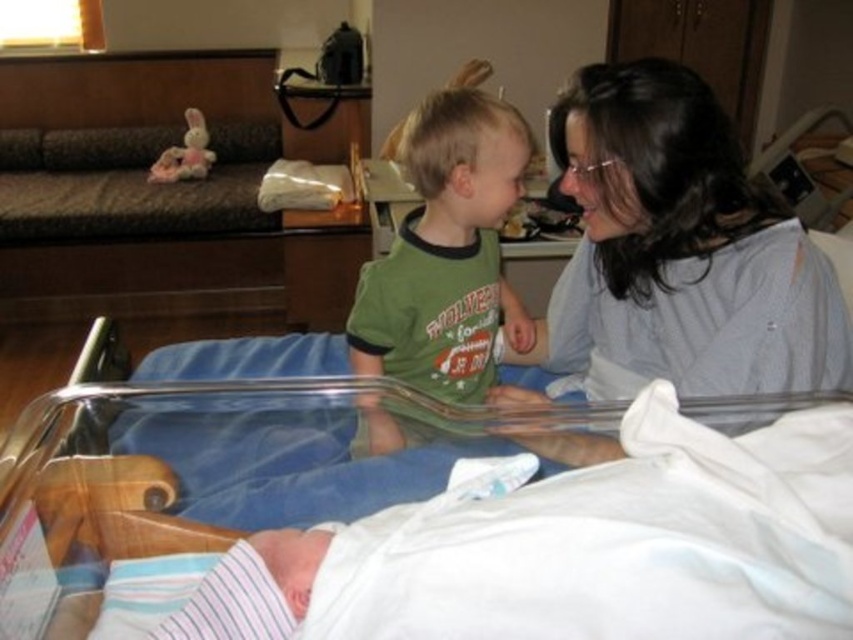
You are a nurse in a hospital room and need to choose between the matte gray shirt at upper right and the green cotton shirt at center for a patient. Which shirt should you pick if you want the one that is wider?

The matte gray shirt at upper right is wider than the green cotton shirt at center, so you should choose the matte gray shirt at upper right.

You are a nurse in the hospital room and need to reach the matte gray shirt at upper right. Considering your arm length is 0.7 meters, can you grab it without moving from your current position?

The matte gray shirt at upper right is 1.18 meters away from the camera, which is further than your arm length of 0.7 meters. You cannot reach it without moving.